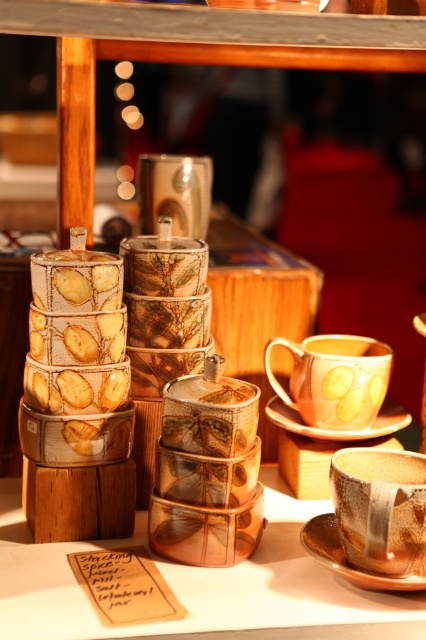
You are setting up a display for a craft fair and need to arrange items according to their positions. Which saucer is positioned lower in the display, the brown ceramic saucer at lower right or the white porcelain saucer at center?

The brown ceramic saucer at lower right is located below the white porcelain saucer at center, so it is positioned lower in the display.

You are standing at the point marked as point (319, 502) in the image. You want to pick up a ceramic mug that is placed to the right of the stacked containers. Can you reach it without moving your feet?

The distance between you and the viewer is 1.14 meters, so you can reach the ceramic mug placed to the right of the stacked containers without moving your feet since the distance is within a comfortable reach.

From the picture: You are organizing a craft fair booth and need to place a decorative centerpiece between the translucent amber glass jars at center and the matte gold cup at lower right. Based on their positions, where should you place the centerpiece?

The translucent amber glass jars at center is to the left of matte gold cup at lower right, so the centerpiece should be placed between them, to the right of the jars and left of the cup.